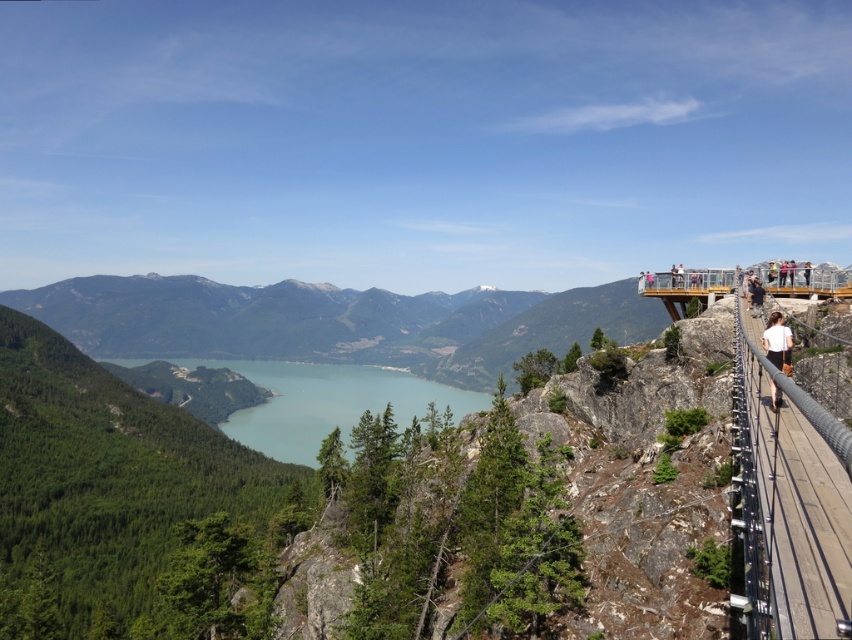
In the scene shown: You are standing on the wooden suspension bridge and looking down. You see the blue glassy lake at center and the white cotton shirt at right. Which object is lower in the scene?

The blue glassy lake at center is lower than the white cotton shirt at right because it is positioned below it.

You are a hiker carrying a backpack and standing on the wooden walkway at right. You notice a white cotton shirt at right hanging nearby. If you want to place your backpack on the walkway, will there be enough space between the walkway and the shirt?

The wooden walkway at right is wider than the white cotton shirt at right, so there should be enough space to place your backpack between them.

You are standing on the wooden suspension bridge and looking down. You see the blue glassy lake at center and the white cotton shirt at right. Which object is higher from the ground?

The blue glassy lake at center is taller than the white cotton shirt at right, so the blue glassy lake at center is higher from the ground.